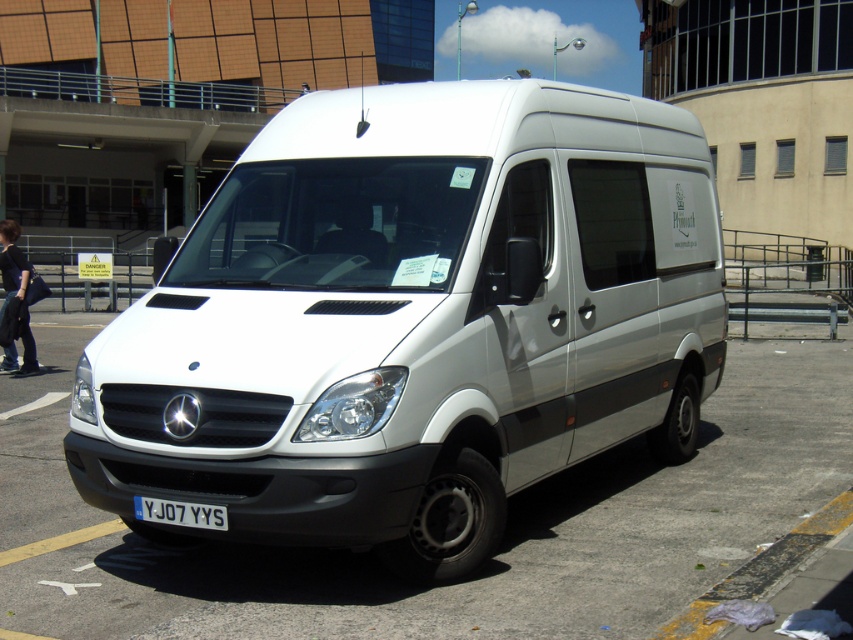
Question: Does white metallic van at center come in front of yellow asphalt curb at lower right?

Choices:
 (A) yes
 (B) no

Answer: (B)

Question: Does white metallic van at center appear over yellow asphalt curb at lower right?

Choices:
 (A) no
 (B) yes

Answer: (B)

Question: Which of the following is the closest to the observer?

Choices:
 (A) (798, 440)
 (B) (166, 509)

Answer: (B)

Question: Among these objects, which one is nearest to the camera?

Choices:
 (A) white metallic van at center
 (B) white plastic license plate at center

Answer: (A)

Question: Does white matte van at center appear over white plastic license plate at center?

Choices:
 (A) no
 (B) yes

Answer: (B)

Question: Which of the following is the closest to the observer?

Choices:
 (A) (102, 515)
 (B) (683, 637)
 (C) (294, 490)

Answer: (B)